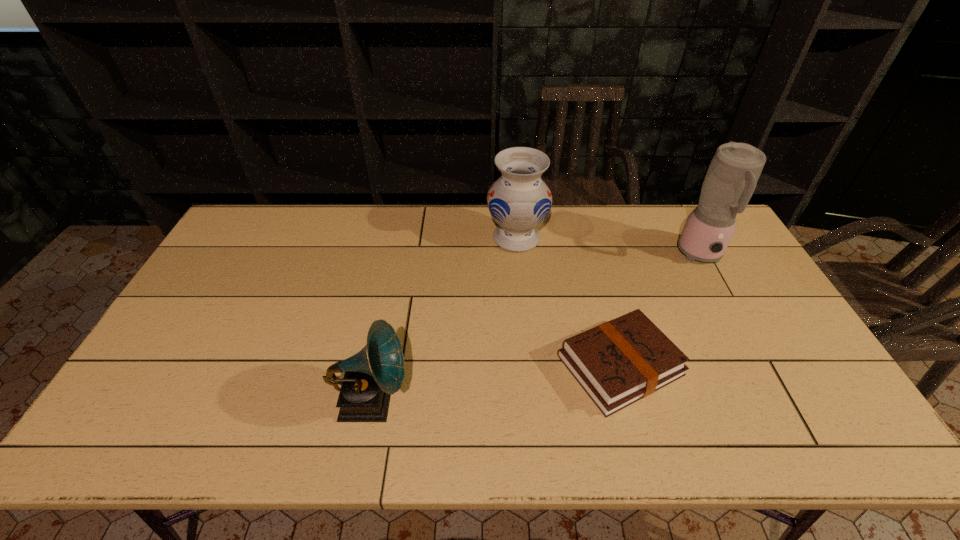
Locate an element on the screen. vacant area that lies between the food processor and the leftmost object is located at coordinates (536, 328).

Choose which object is the second nearest neighbor to the vase. Please provide its 2D coordinates. Your answer should be formatted as a tuple, i.e. [(x, y)], where the tuple contains the x and y coordinates of a point satisfying the conditions above.

[(732, 176)]

Locate which object is the second closest to the vase. Please provide its 2D coordinates. Your answer should be formatted as a tuple, i.e. [(x, y)], where the tuple contains the x and y coordinates of a point satisfying the conditions above.

[(732, 176)]

You are a GUI agent. You are given a task and a screenshot of the screen. Output one action in this format:
    pyautogui.click(x=<x>, y=<y>)
    Task: Click on the blank space that satisfies the following two spatial constraints: 1. on the base of the tallest object near the control knob; 2. from the horn of the leftmost object
    
    Given the screenshot: What is the action you would take?
    [x=780, y=401]

This screenshot has height=540, width=960. Find the location of `vacant region that satisfies the following two spatial constraints: 1. on the front side of the vase; 2. from the horn of the leftmost object`. vacant region that satisfies the following two spatial constraints: 1. on the front side of the vase; 2. from the horn of the leftmost object is located at coordinates (532, 401).

Locate an element on the screen. This screenshot has width=960, height=540. free location that satisfies the following two spatial constraints: 1. on the base of the food processor near the control knob; 2. from the horn of the third tallest object is located at coordinates (780, 401).

Where is `vacant space that satisfies the following two spatial constraints: 1. on the front side of the vase; 2. on the left side of the shortest object`? vacant space that satisfies the following two spatial constraints: 1. on the front side of the vase; 2. on the left side of the shortest object is located at coordinates (529, 365).